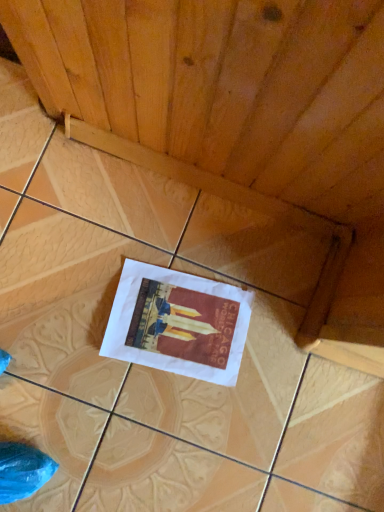
Find the location of a particular element. free location to the right of white paper poster at center is located at coordinates (261, 394).